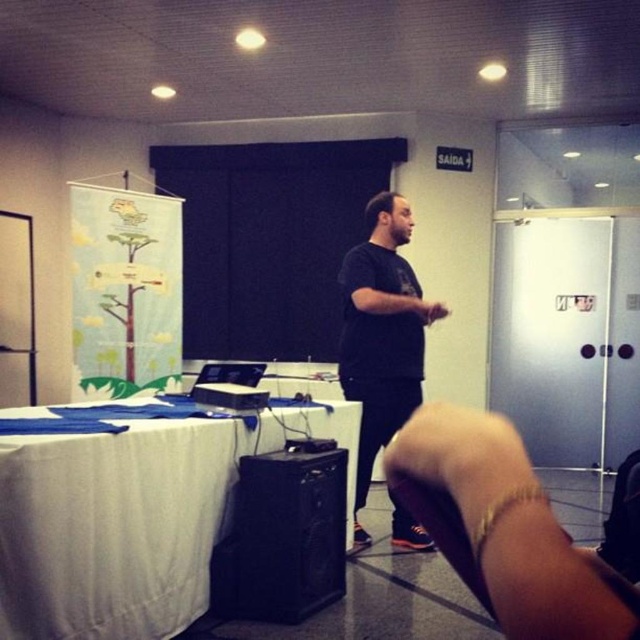
Question: Is white fabric table at lower left thinner than black plastic projector at center?

Choices:
 (A) no
 (B) yes

Answer: (A)

Question: Considering the relative positions of black matte shirt at center and black plastic projector at center in the image provided, where is black matte shirt at center located with respect to black plastic projector at center?

Choices:
 (A) right
 (B) left

Answer: (A)

Question: Can you confirm if white fabric table at lower left is positioned to the left of black matte shirt at center?

Choices:
 (A) no
 (B) yes

Answer: (B)

Question: Estimate the real-world distances between objects in this image. Which object is farther from the black plastic projector at center?

Choices:
 (A) black matte shirt at center
 (B) white fabric table at lower left

Answer: (A)

Question: Based on their relative distances, which object is nearer to the black matte shirt at center?

Choices:
 (A) white fabric table at lower left
 (B) black plastic projector at center

Answer: (B)

Question: Which point appears farthest from the camera in this image?

Choices:
 (A) coord(161,420)
 (B) coord(241,388)

Answer: (B)